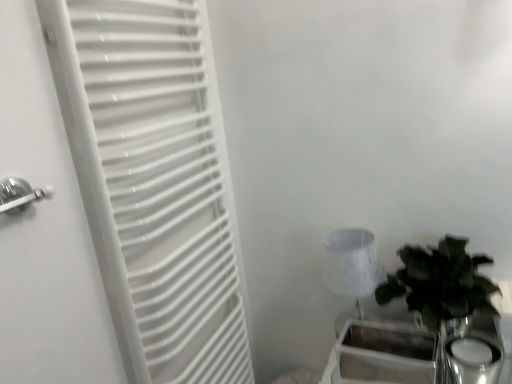
Question: Can you confirm if metallic silver tray at lower right is bigger than white matte radiator at left?

Choices:
 (A) no
 (B) yes

Answer: (A)

Question: From a real-world perspective, is metallic silver tray at lower right beneath white matte radiator at left?

Choices:
 (A) no
 (B) yes

Answer: (B)

Question: Is metallic silver tray at lower right smaller than white matte radiator at left?

Choices:
 (A) yes
 (B) no

Answer: (A)

Question: Would you say metallic silver tray at lower right is a long distance from white matte radiator at left?

Choices:
 (A) yes
 (B) no

Answer: (B)

Question: Is metallic silver tray at lower right at the left side of white matte radiator at left?

Choices:
 (A) yes
 (B) no

Answer: (B)

Question: Is metallic silver tray at lower right not inside white matte radiator at left?

Choices:
 (A) no
 (B) yes

Answer: (B)

Question: Considering the relative sizes of green leafy plant in glass vase at right and metallic silver tray at lower right in the image provided, is green leafy plant in glass vase at right smaller than metallic silver tray at lower right?

Choices:
 (A) no
 (B) yes

Answer: (A)

Question: From a real-world perspective, is green leafy plant in glass vase at right over metallic silver tray at lower right?

Choices:
 (A) yes
 (B) no

Answer: (A)

Question: Considering the relative sizes of green leafy plant in glass vase at right and metallic silver tray at lower right in the image provided, is green leafy plant in glass vase at right taller than metallic silver tray at lower right?

Choices:
 (A) no
 (B) yes

Answer: (B)

Question: Considering the relative sizes of green leafy plant in glass vase at right and metallic silver tray at lower right in the image provided, is green leafy plant in glass vase at right wider than metallic silver tray at lower right?

Choices:
 (A) yes
 (B) no

Answer: (A)

Question: Is green leafy plant in glass vase at right at the right side of metallic silver tray at lower right?

Choices:
 (A) yes
 (B) no

Answer: (A)

Question: Considering the relative positions of green leafy plant in glass vase at right and metallic silver tray at lower right in the image provided, is green leafy plant in glass vase at right to the left of metallic silver tray at lower right from the viewer's perspective?

Choices:
 (A) no
 (B) yes

Answer: (A)

Question: Considering the relative sizes of white matte radiator at left and metallic silver tray at lower right in the image provided, is white matte radiator at left bigger than metallic silver tray at lower right?

Choices:
 (A) no
 (B) yes

Answer: (B)